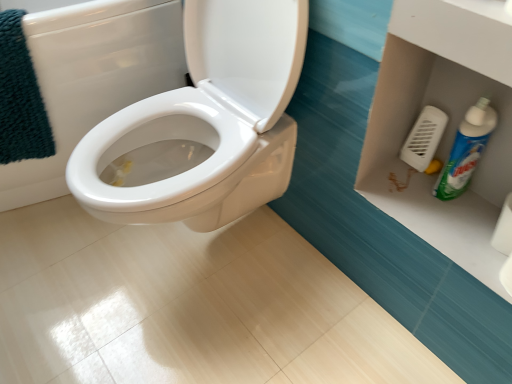
Locate an element on the screen. empty space that is ontop of white plastic shelf at upper right is located at coordinates (447, 210).